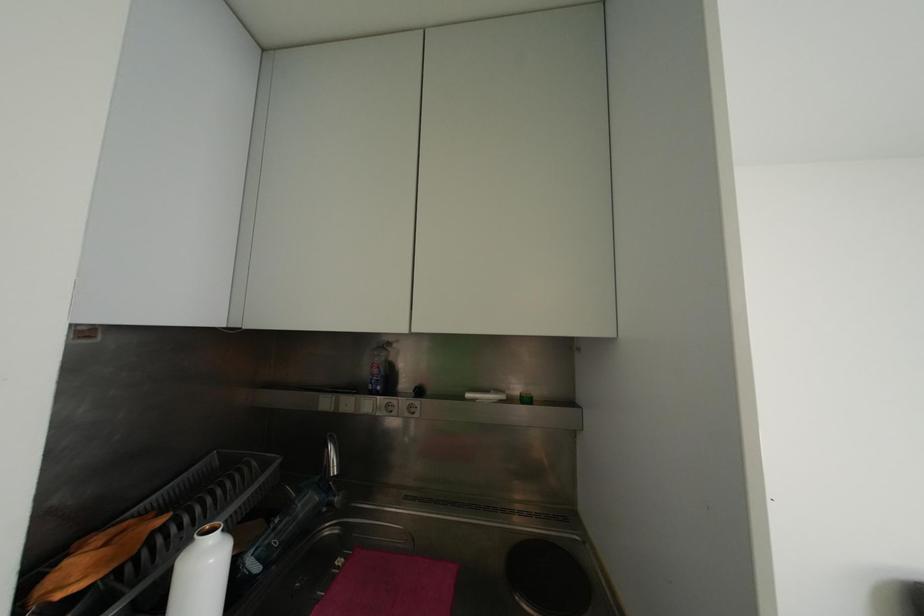
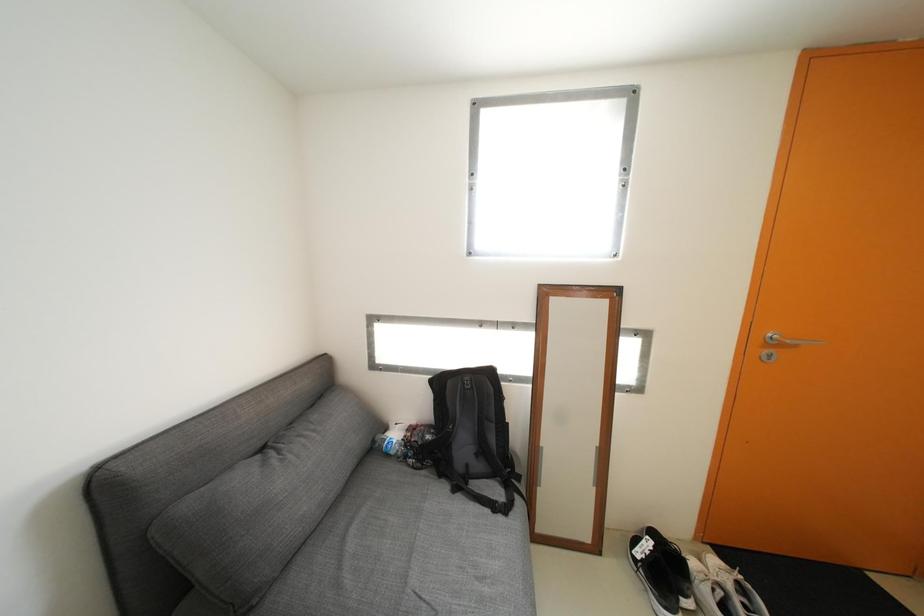
Question: Based on the continuous images, in which direction is the camera rotating? Reply with the corresponding letter.

Choices:
 (A) Left
 (B) Right
 (C) Up
 (D) Down

Answer: (B)